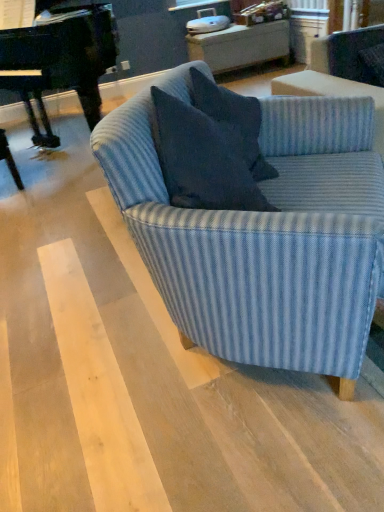
The width and height of the screenshot is (384, 512). What are the coordinates of `vacant space to the left of blue striped fabric couch at center` in the screenshot? It's located at (74, 315).